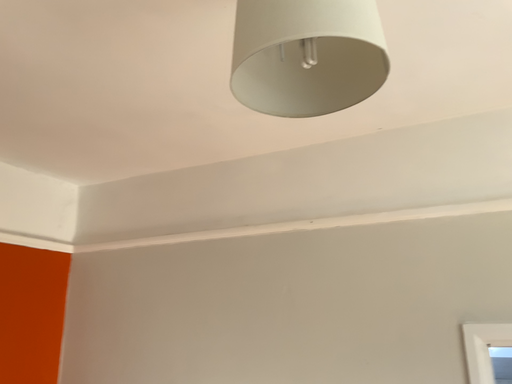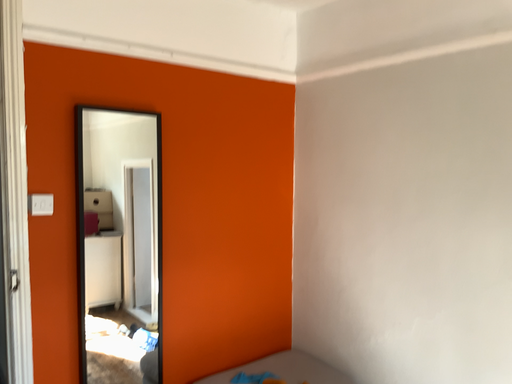
Question: Which way did the camera rotate in the video?

Choices:
 (A) rotated left
 (B) rotated right

Answer: (A)